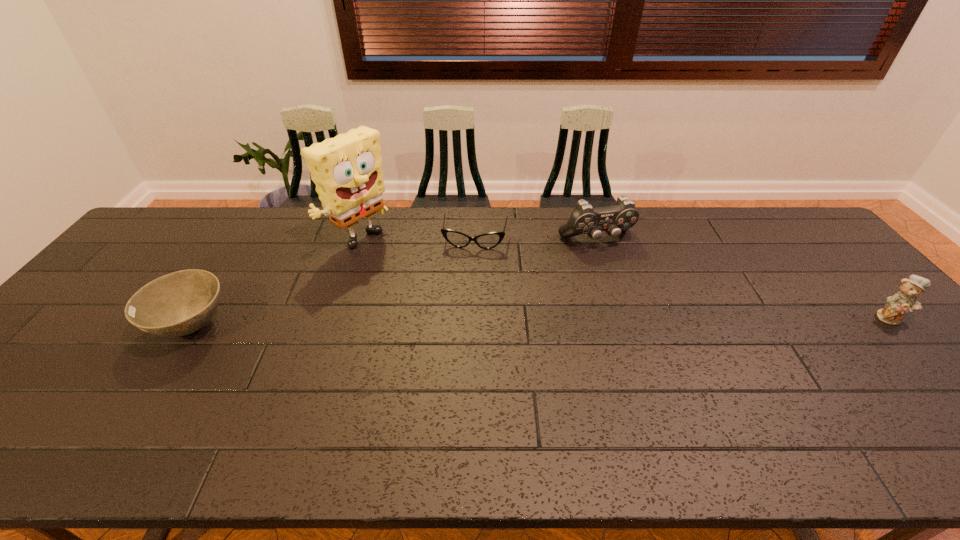
The height and width of the screenshot is (540, 960). Identify the location of the leftmost object. tap(177, 304).

Where is `bowl`? Image resolution: width=960 pixels, height=540 pixels. bowl is located at coordinates (177, 304).

At what (x,y) coordinates should I click in order to perform the action: click on the rightmost object. Please return your answer as a coordinate pair (x, y). Looking at the image, I should click on 904,300.

Image resolution: width=960 pixels, height=540 pixels. In order to click on sponge in this screenshot , I will do `click(347, 170)`.

Find the location of a particular element. the second object from left to right is located at coordinates (347, 170).

At what (x,y) coordinates should I click in order to perform the action: click on control. Please return your answer as a coordinate pair (x, y). Image resolution: width=960 pixels, height=540 pixels. Looking at the image, I should click on (584, 219).

I want to click on the shortest object, so click(457, 239).

This screenshot has height=540, width=960. I want to click on the third object from left to right, so click(457, 239).

This screenshot has width=960, height=540. Identify the location of vacant position located 0.230m on the left of the bowl. (65, 327).

I want to click on free spot located 0.110m on the front-facing side of the rightmost object, so click(x=930, y=360).